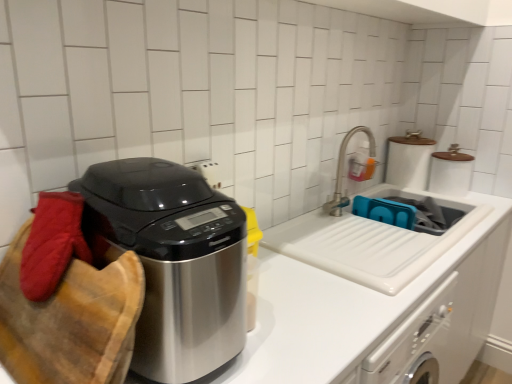
Question: From a real-world perspective, is white glossy sink at center located higher than brushed metal faucet at upper right?

Choices:
 (A) no
 (B) yes

Answer: (A)

Question: Is white glossy sink at center smaller than brushed metal faucet at upper right?

Choices:
 (A) yes
 (B) no

Answer: (B)

Question: Is white glossy sink at center closer to camera compared to brushed metal faucet at upper right?

Choices:
 (A) yes
 (B) no

Answer: (A)

Question: Does white glossy sink at center have a larger size compared to brushed metal faucet at upper right?

Choices:
 (A) no
 (B) yes

Answer: (B)

Question: Considering the relative positions of white glossy sink at center and brushed metal faucet at upper right in the image provided, is white glossy sink at center to the left of brushed metal faucet at upper right from the viewer's perspective?

Choices:
 (A) no
 (B) yes

Answer: (A)

Question: From a real-world perspective, does white glossy sink at center sit lower than brushed metal faucet at upper right?

Choices:
 (A) no
 (B) yes

Answer: (B)

Question: Does blue plastic sink at center have a greater height compared to polished stainless steel appliance at left?

Choices:
 (A) yes
 (B) no

Answer: (B)

Question: From a real-world perspective, is blue plastic sink at center positioned under polished stainless steel appliance at left based on gravity?

Choices:
 (A) no
 (B) yes

Answer: (B)

Question: Is blue plastic sink at center at the left side of polished stainless steel appliance at left?

Choices:
 (A) yes
 (B) no

Answer: (B)

Question: From a real-world perspective, is blue plastic sink at center positioned over polished stainless steel appliance at left based on gravity?

Choices:
 (A) yes
 (B) no

Answer: (B)

Question: Are blue plastic sink at center and polished stainless steel appliance at left located far from each other?

Choices:
 (A) yes
 (B) no

Answer: (A)

Question: Is blue plastic sink at center positioned behind polished stainless steel appliance at left?

Choices:
 (A) yes
 (B) no

Answer: (A)

Question: Can you confirm if white glossy sink at center is taller than blue plastic sink at center?

Choices:
 (A) yes
 (B) no

Answer: (A)